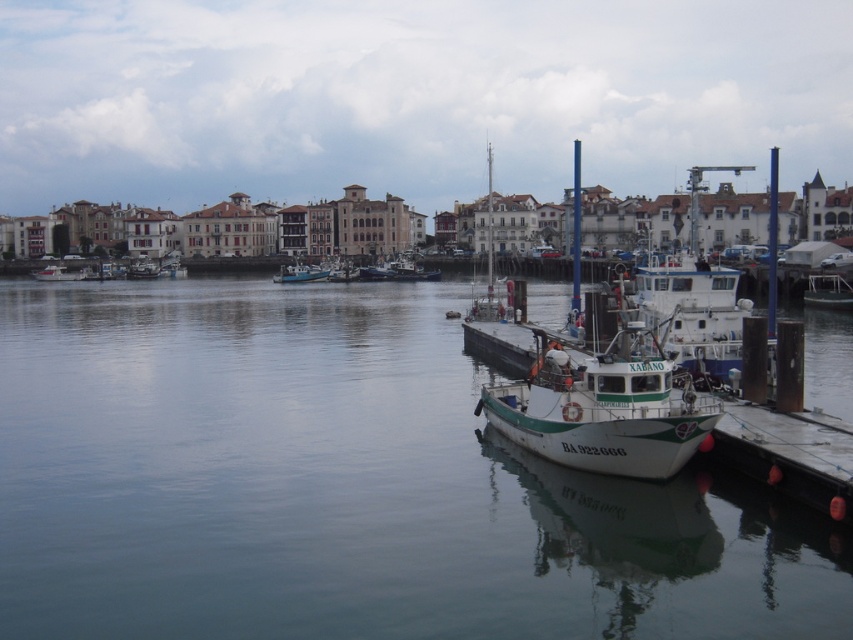
Question: Which object is closer to the camera taking this photo?

Choices:
 (A) white matte boat at center
 (B) white wooden boat at center
 (C) green matte boat at right

Answer: (A)

Question: Is green matte boat at right thinner than white wooden boat at center?

Choices:
 (A) no
 (B) yes

Answer: (B)

Question: Estimate the real-world distances between objects in this image. Which object is closer to the white glossy boat at left?

Choices:
 (A) green matte boat at right
 (B) clear water at center
 (C) white wooden boat at center
 (D) teal matte boat at center

Answer: (D)

Question: Does green matte boat at right appear over teal matte boat at center?

Choices:
 (A) no
 (B) yes

Answer: (A)

Question: Is clear water at center positioned behind teal matte boat at center?

Choices:
 (A) no
 (B) yes

Answer: (A)

Question: Among these points, which one is farthest from the camera?

Choices:
 (A) [490, 209]
 (B) [3, 465]
 (C) [815, 291]
 (D) [287, 282]

Answer: (A)